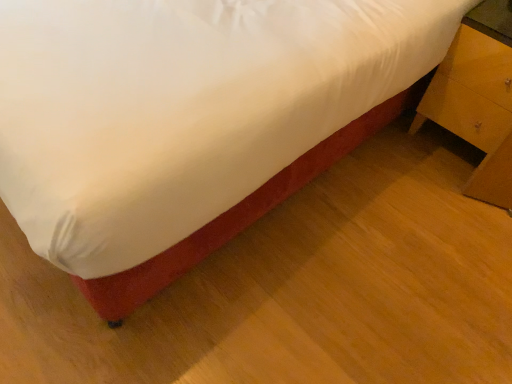
What do you see at coordinates (478, 98) in the screenshot?
I see `wooden nightstand at right` at bounding box center [478, 98].

The width and height of the screenshot is (512, 384). Identify the location of wooden nightstand at right. (478, 98).

Identify the location of wooden nightstand at right. (478, 98).